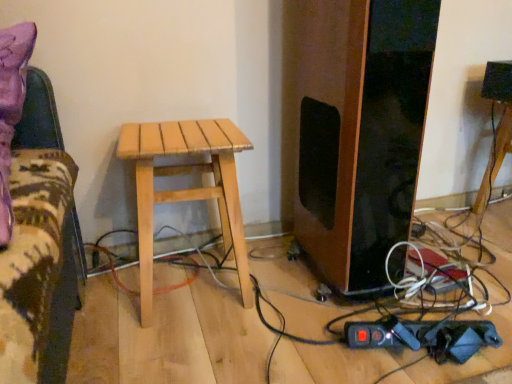
The height and width of the screenshot is (384, 512). Identify the location of vacant space underneath wooden stool at center (from a real-world perspective). (500, 213).